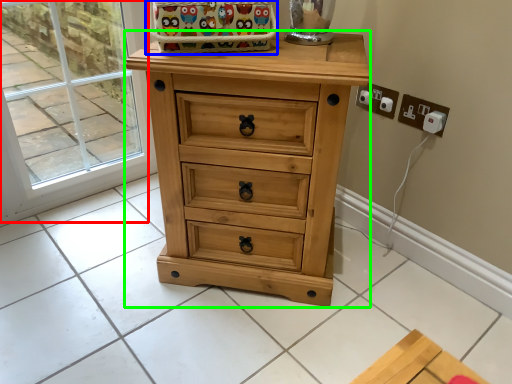
Question: Which object is positioned closest to glass door (highlighted by a red box)? Select from basket (highlighted by a blue box) and chest of drawers (highlighted by a green box).

Choices:
 (A) basket
 (B) chest of drawers

Answer: (A)